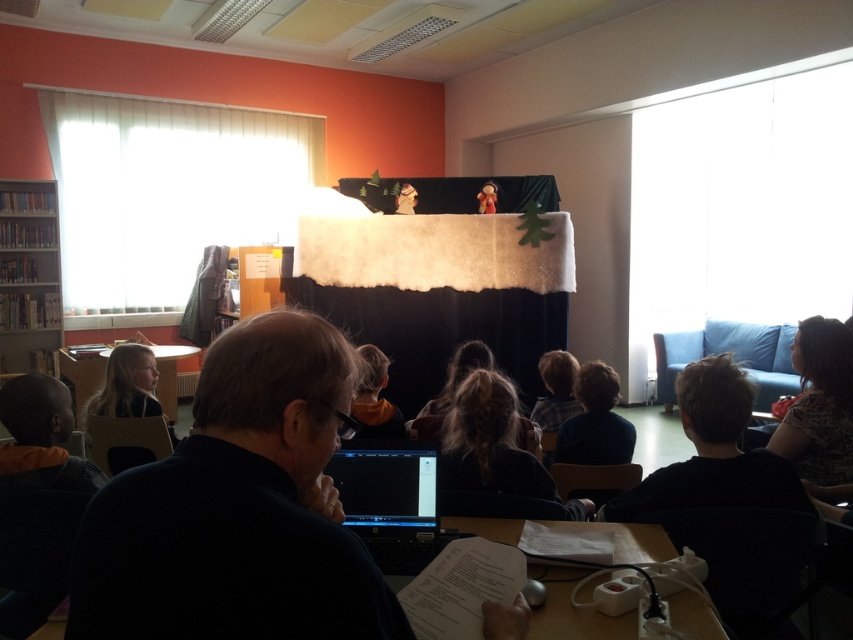
Question: Does wooden bookshelf at left appear on the right side of matte wood table at lower left?

Choices:
 (A) no
 (B) yes

Answer: (A)

Question: Is wooden bookshelf at left bigger than matte wood table at lower left?

Choices:
 (A) yes
 (B) no

Answer: (B)

Question: Which object appears farthest from the camera in this image?

Choices:
 (A) dark blue shirt at center
 (B) wooden table at center
 (C) black matte laptop at lower center

Answer: (C)

Question: Observing the image, what is the correct spatial positioning of white matte projection screen at upper left in reference to wooden bookshelf at left?

Choices:
 (A) right
 (B) left

Answer: (A)

Question: Which point is farther to the camera?

Choices:
 (A) dark blue shirt at center
 (B) wooden table at center
 (C) matte wood table at lower left

Answer: (C)

Question: Which object is closer to the camera taking this photo?

Choices:
 (A) wooden table at center
 (B) white matte projection screen at upper left
 (C) black matte laptop at lower center

Answer: (A)